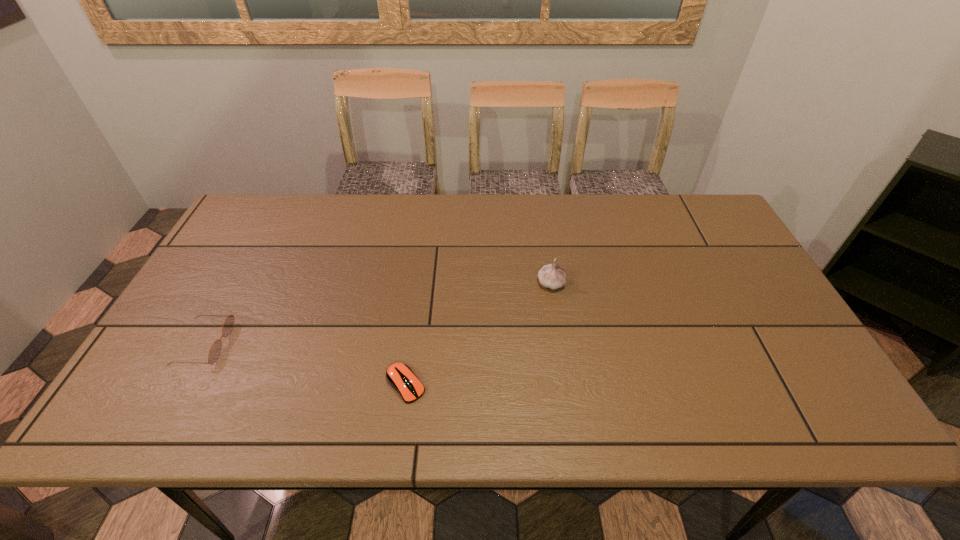
Locate an element on the screen. This screenshot has height=540, width=960. free point that satisfies the following two spatial constraints: 1. on the face of the second object from right to left; 2. on the left side of the sunglasses is located at coordinates (182, 384).

Locate an element on the screen. vacant area that satisfies the following two spatial constraints: 1. on the back side of the tallest object; 2. on the left side of the shortest object is located at coordinates (420, 284).